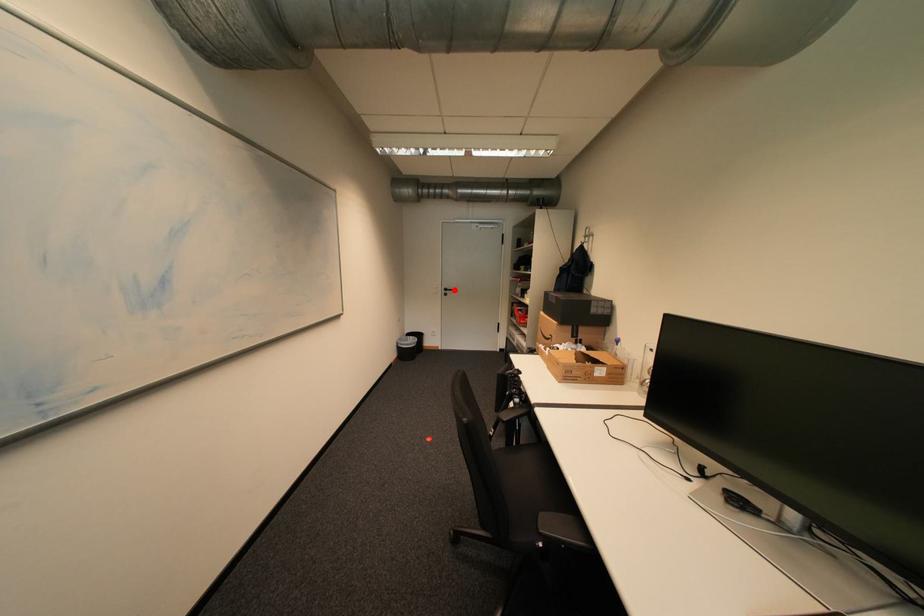
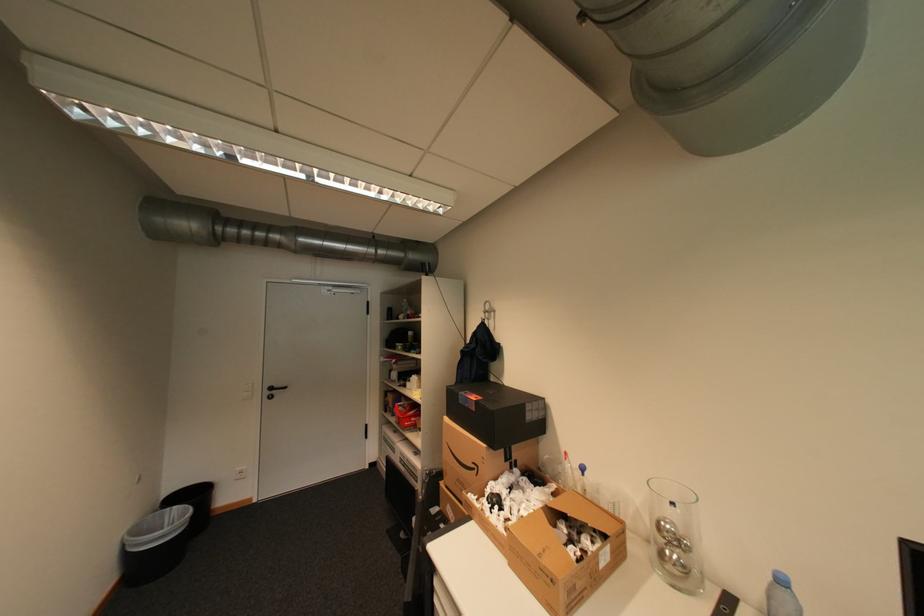
Find the pixel in the second image that matches the highlighted location in the first image.

(280, 389)